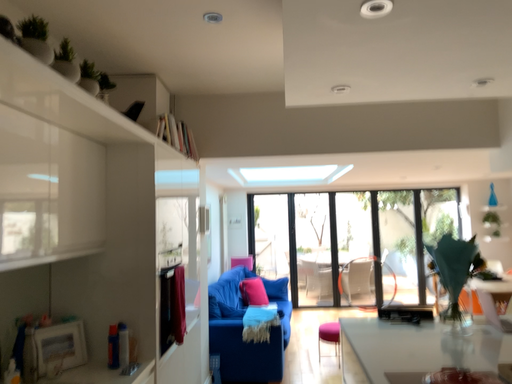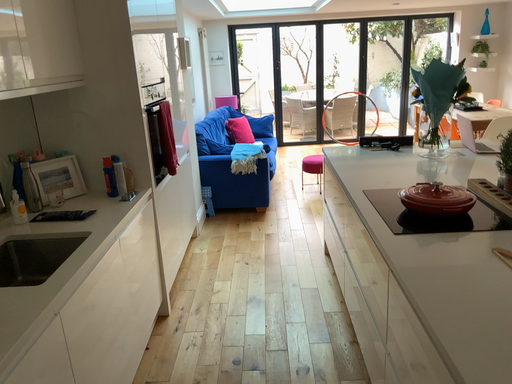
Question: How did the camera likely rotate when shooting the video?

Choices:
 (A) rotated upward
 (B) rotated downward

Answer: (B)